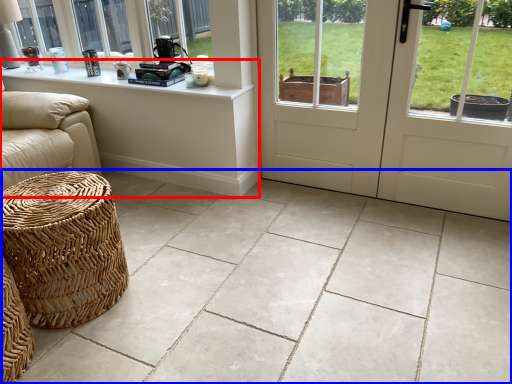
Question: Which object appears closest to the camera in this image, table (highlighted by a red box) or ceramic tile (highlighted by a blue box)?

Choices:
 (A) table
 (B) ceramic tile

Answer: (B)